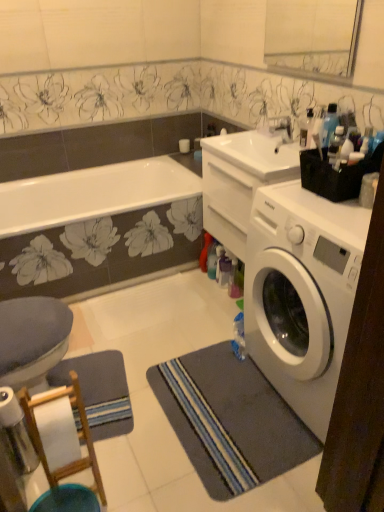
This screenshot has height=512, width=384. I want to click on vacant point above blue fabric toilet at lower left (from a real-world perspective), so click(x=26, y=317).